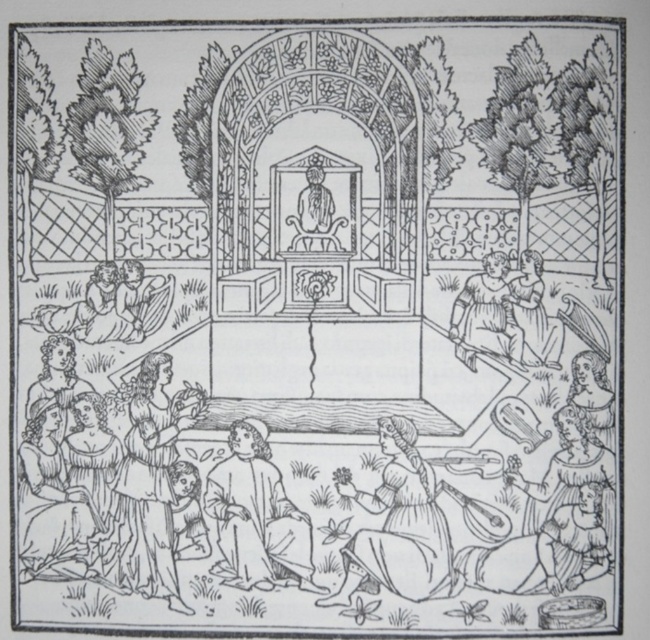
Can you confirm if smooth brown dress at lower left is positioned to the right of smooth brown dress at right?

Incorrect, smooth brown dress at lower left is not on the right side of smooth brown dress at right.

The width and height of the screenshot is (650, 640). Identify the location of smooth brown dress at lower left. (55, 504).

Who is more distant from viewer, [58,419] or [533,292]?

The point [58,419] is behind.

I want to click on smooth brown dress at lower left, so click(55, 504).

Who is taller, smooth skin figure at lower left or smooth brown dress at right?

Standing taller between the two is smooth brown dress at right.

Does smooth skin figure at lower left appear over smooth brown dress at right?

Yes.

Does point (112, 275) come closer to viewer compared to point (526, 273)?

No, (112, 275) is behind (526, 273).

I want to click on smooth skin figure at lower left, so click(x=105, y=307).

Who is lower down, smooth brown dress at lower left or smooth skin figure at lower left?

smooth brown dress at lower left

The image size is (650, 640). Find the location of `smooth brown dress at lower left`. smooth brown dress at lower left is located at coordinates (55, 504).

Where is `smooth brown dress at lower left`? Image resolution: width=650 pixels, height=640 pixels. smooth brown dress at lower left is located at coordinates (55, 504).